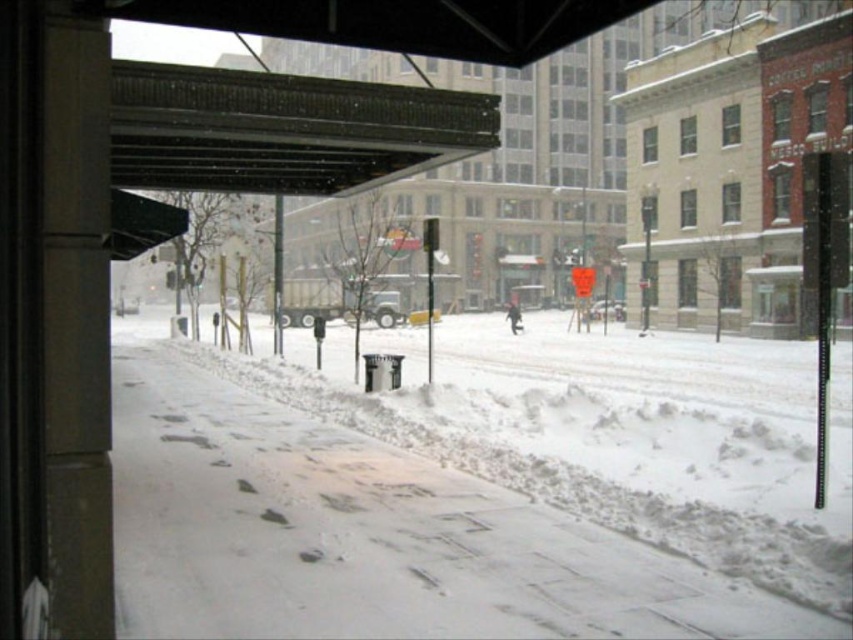
You are standing on the sidewalk and looking towards the street. Which object is closer to your feet, the white snow at lower center or the metallic corrugated roof at upper center?

The white snow at lower center is closer to your feet because it is positioned below the metallic corrugated roof at upper center.

You are standing on the sidewalk and want to know if the white snow at lower center is wider than the metallic corrugated roof at upper center. Can you determine this based on the scene?

The white snow at lower center is wider than the metallic corrugated roof at upper center according to the description.

You are standing on the sidewalk in the snowy urban scene. You see two points marked on the ground. The first point is at coordinates point [618,612] and the second point is at point [368,129]. Which point is closer to your current position?

Point [618,612] is closer to the viewer than point [368,129]. Therefore, the first point is closer to your current position.